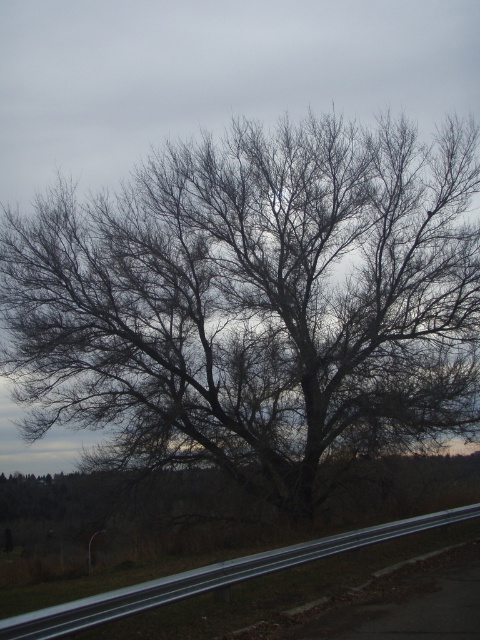
You are standing at the point marked by coordinates point [254,304] in the image. What do you see directly in front of you?

You see bare branches at center directly in front of you at point [254,304].